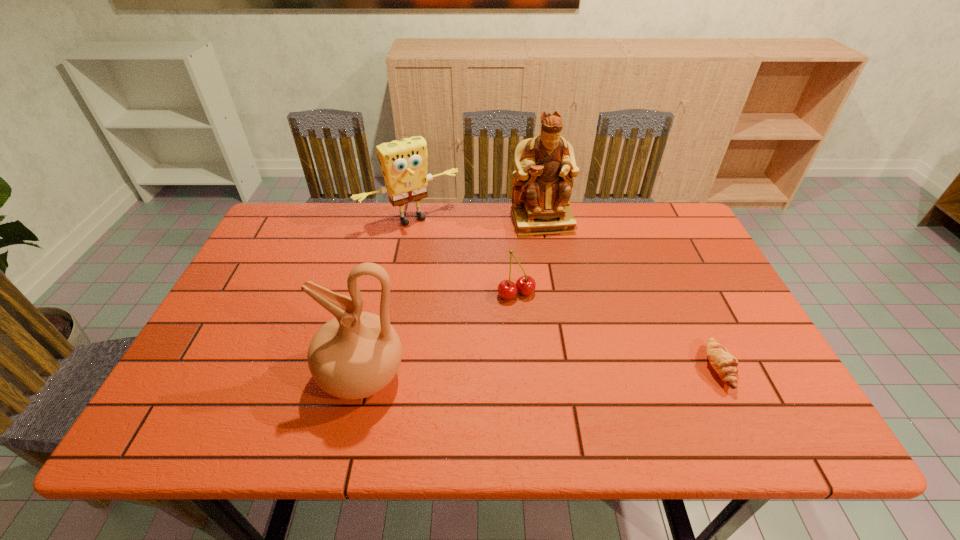
I want to click on free location located 0.090m on the front-facing side of the shortest object, so click(774, 368).

Locate an element on the screen. This screenshot has width=960, height=540. free space located with the stems of the second shortest object pointing upwards is located at coordinates (532, 316).

Find the location of a particular element. vacant space located with the stems of the second shortest object pointing upwards is located at coordinates (572, 384).

I want to click on vacant space located with the stems of the second shortest object pointing upwards, so click(537, 325).

This screenshot has height=540, width=960. I want to click on vacant region located 0.100m on the face of the sponge, so click(445, 252).

You are a GUI agent. You are given a task and a screenshot of the screen. Output one action in this format:
    pyautogui.click(x=<x>, y=<y>)
    Task: Click on the vacant space located on the face of the sponge
    Image resolution: width=960 pixels, height=540 pixels.
    Given the screenshot: What is the action you would take?
    pyautogui.click(x=460, y=269)

The width and height of the screenshot is (960, 540). I want to click on free location located 0.070m on the face of the sponge, so click(442, 246).

Identify the location of free region located 0.310m on the front-facing side of the figurine. The height and width of the screenshot is (540, 960). (569, 312).

Where is `free space located 0.350m on the front-facing side of the figurine`? free space located 0.350m on the front-facing side of the figurine is located at coordinates (573, 323).

Locate an element on the screen. free point located on the front-facing side of the figurine is located at coordinates (555, 263).